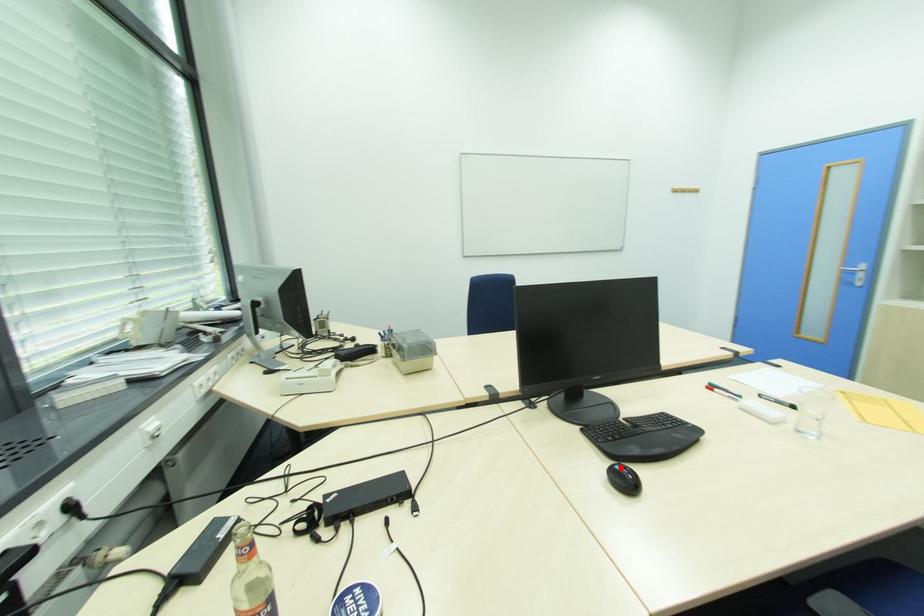
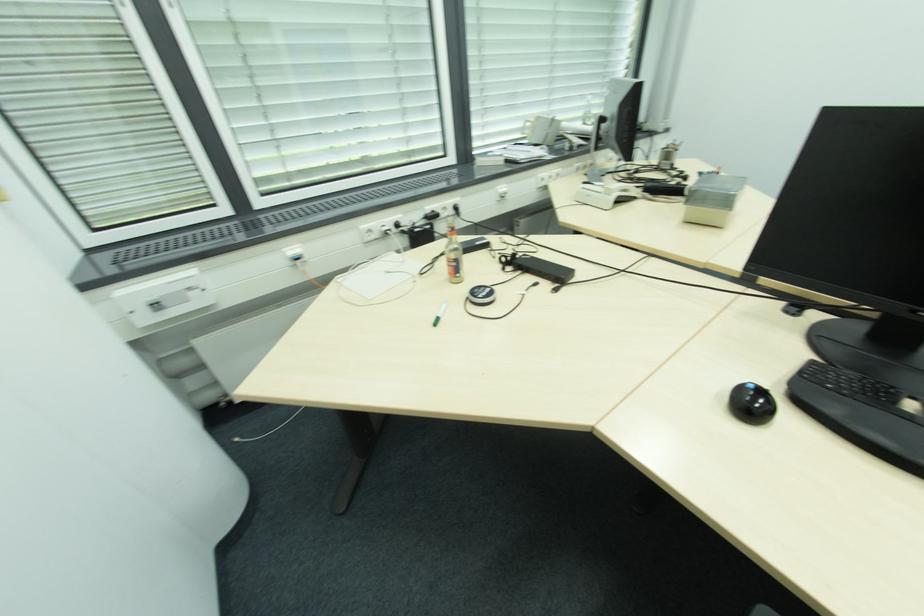
Locate, in the second image, the point that corresponds to the highlighted location in the first image.

(755, 387)